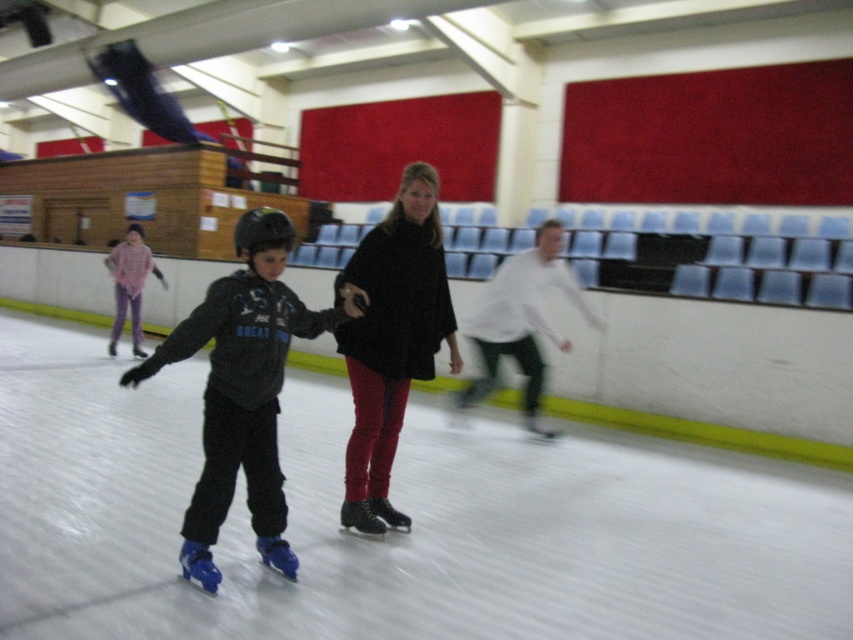
Question: Does black matte/black fabric at center have a lesser width compared to plush pink sweater at left?

Choices:
 (A) yes
 (B) no

Answer: (B)

Question: Is matte blue roller skates at center closer to camera compared to white matte jacket at center?

Choices:
 (A) yes
 (B) no

Answer: (A)

Question: Does matte blue roller skates at center appear on the right side of black matte/black fabric at center?

Choices:
 (A) no
 (B) yes

Answer: (A)

Question: Which of the following is the closest to the observer?

Choices:
 (A) (271, 307)
 (B) (480, 353)
 (C) (138, 227)

Answer: (A)

Question: Which point is closer to the camera?

Choices:
 (A) matte blue roller skates at center
 (B) white matte jacket at center
 (C) plush pink sweater at left
 (D) black matte/black fabric at center

Answer: (A)

Question: Which object is positioned closest to the black matte/black fabric at center?

Choices:
 (A) matte blue roller skates at center
 (B) white matte jacket at center
 (C) plush pink sweater at left

Answer: (A)